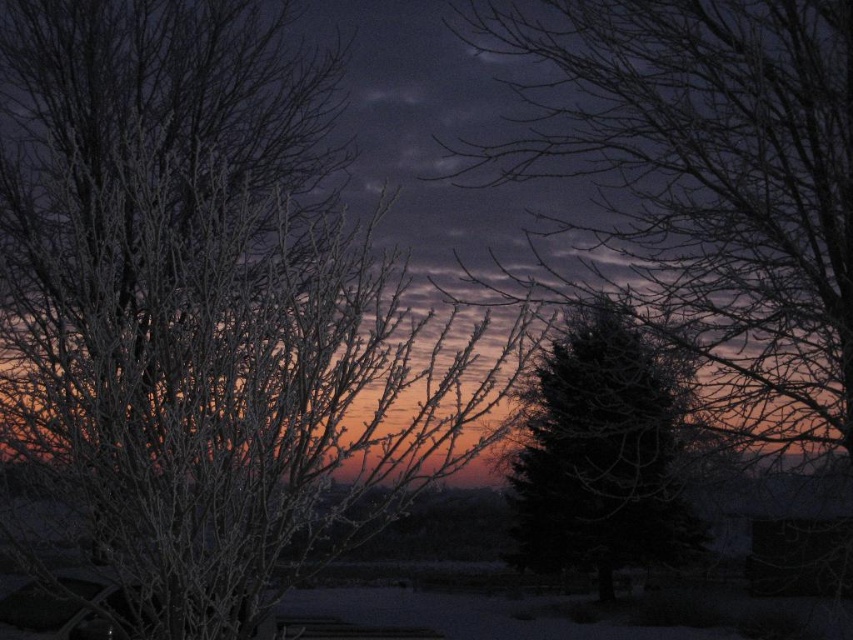
Question: Which of the following is the farthest from the observer?

Choices:
 (A) frosted white branches at left
 (B) green matte tree at center

Answer: (B)

Question: Does frosted branches at center have a larger size compared to green matte tree at center?

Choices:
 (A) yes
 (B) no

Answer: (B)

Question: Among these points, which one is nearest to the camera?

Choices:
 (A) (x=608, y=36)
 (B) (x=584, y=502)
 (C) (x=347, y=310)

Answer: (C)

Question: Among these objects, which one is farthest from the camera?

Choices:
 (A) frosted white branches at left
 (B) green matte tree at center

Answer: (B)

Question: Is frosted white branches at left bigger than green matte tree at center?

Choices:
 (A) yes
 (B) no

Answer: (A)

Question: Observing the image, what is the correct spatial positioning of frosted white branches at left in reference to green matte tree at center?

Choices:
 (A) right
 (B) left

Answer: (B)